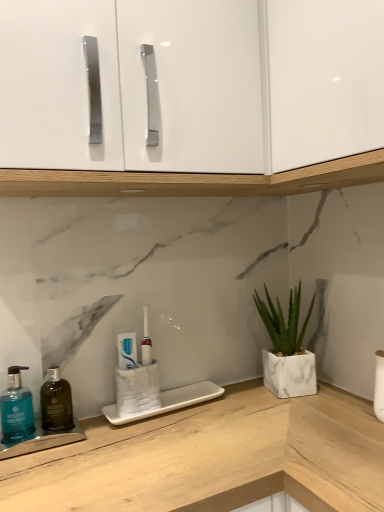
Question: Is white glossy toothpaste at center positioned behind dark green glass mouthwash at left?

Choices:
 (A) yes
 (B) no

Answer: (A)

Question: Is dark green glass mouthwash at left at the back of white glossy toothpaste at center?

Choices:
 (A) no
 (B) yes

Answer: (A)

Question: Are white glossy toothpaste at center and dark green glass mouthwash at left far apart?

Choices:
 (A) no
 (B) yes

Answer: (A)

Question: Can you confirm if white glossy toothpaste at center is shorter than dark green glass mouthwash at left?

Choices:
 (A) no
 (B) yes

Answer: (B)

Question: Can you confirm if white glossy toothpaste at center is positioned to the left of dark green glass mouthwash at left?

Choices:
 (A) yes
 (B) no

Answer: (B)

Question: Would you say teal matte soap dispenser at lower left is to the left or to the right of white glossy toothpaste at center in the picture?

Choices:
 (A) right
 (B) left

Answer: (B)

Question: In terms of width, does teal matte soap dispenser at lower left look wider or thinner when compared to white glossy toothpaste at center?

Choices:
 (A) thin
 (B) wide

Answer: (B)

Question: Considering the positions of point (11, 440) and point (130, 359), is point (11, 440) closer or farther from the camera than point (130, 359)?

Choices:
 (A) closer
 (B) farther

Answer: (A)

Question: In terms of size, does teal matte soap dispenser at lower left appear bigger or smaller than white glossy toothpaste at center?

Choices:
 (A) small
 (B) big

Answer: (B)

Question: Is white glossy cabinet doors at upper center wider or thinner than white marble planter at right?

Choices:
 (A) wide
 (B) thin

Answer: (A)

Question: Do you think white glossy cabinet doors at upper center is within white marble planter at right, or outside of it?

Choices:
 (A) outside
 (B) inside

Answer: (A)

Question: Would you say white glossy cabinet doors at upper center is to the left or to the right of white marble planter at right in the picture?

Choices:
 (A) left
 (B) right

Answer: (A)

Question: In terms of size, does white glossy cabinet doors at upper center appear bigger or smaller than white marble planter at right?

Choices:
 (A) big
 (B) small

Answer: (A)

Question: Is white marble planter at right taller or shorter than white glossy toothpaste at center?

Choices:
 (A) short
 (B) tall

Answer: (B)

Question: Is white marble planter at right spatially inside white glossy toothpaste at center, or outside of it?

Choices:
 (A) inside
 (B) outside

Answer: (B)